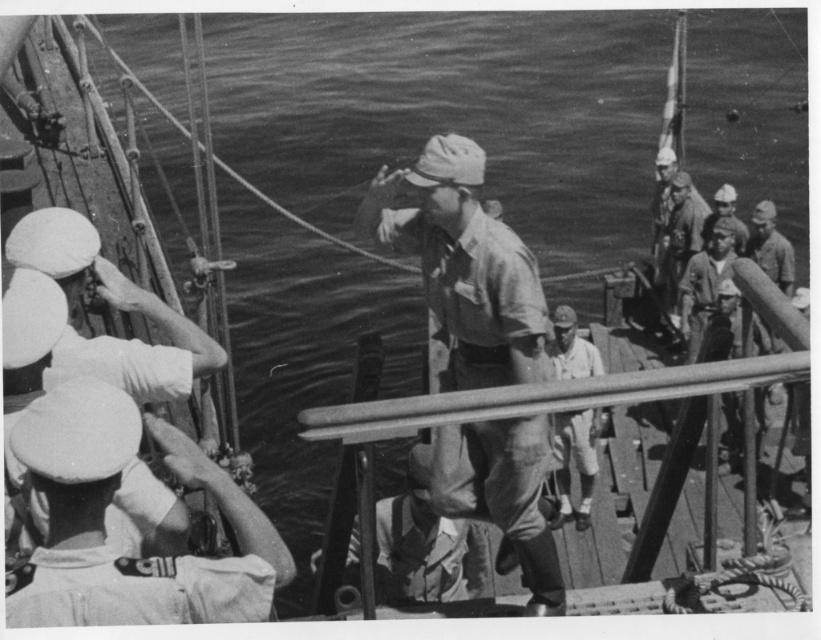
You are a photographer on the ship deck and want to take a photo that includes both point (67, 557) and point (563, 328). Since you want the closer point to be in focus, which point should you focus on?

Point (67, 557) is closer to the camera than point (563, 328), so you should focus on point (67, 557) to ensure it is in focus.